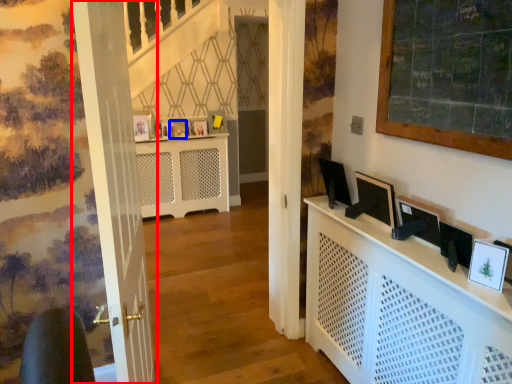
Question: Which object is closer to the camera taking this photo, door (highlighted by a red box) or picture frame (highlighted by a blue box)?

Choices:
 (A) door
 (B) picture frame

Answer: (A)